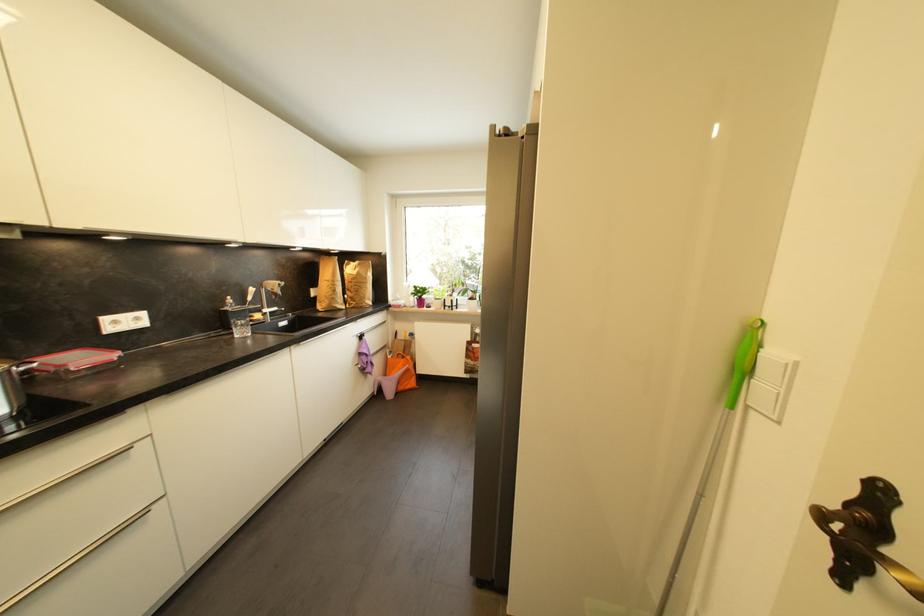
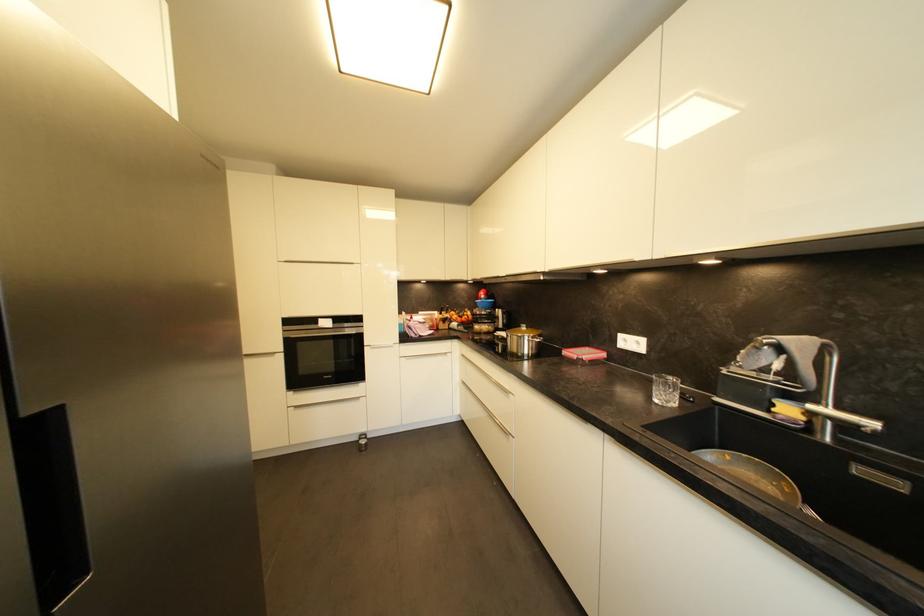
Locate, in the second image, the point that corresponds to (142,321) in the first image.

(642, 345)